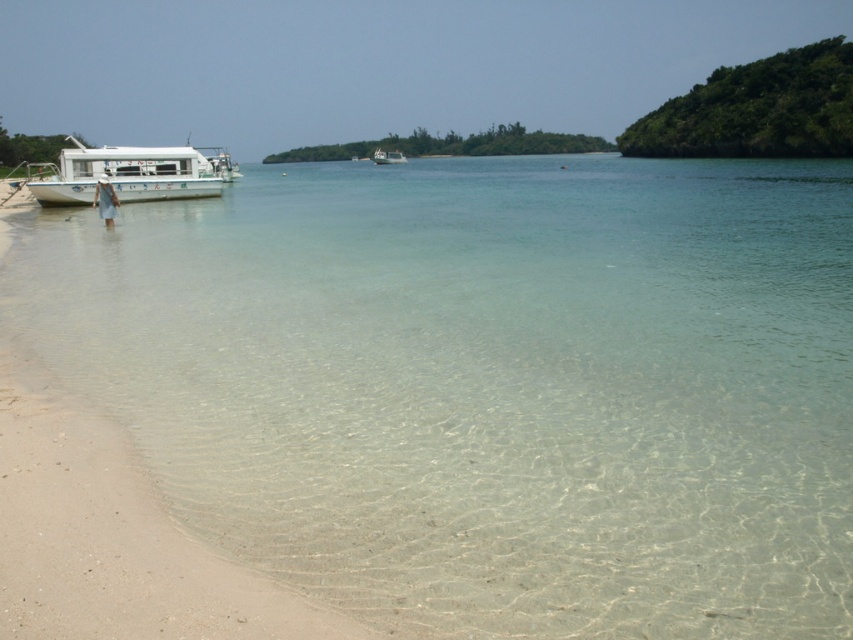
Between white matte boat at left and white glossy boat at center, which one appears on the right side from the viewer's perspective?

Positioned to the right is white glossy boat at center.

Is white matte boat at left taller than white glossy boat at center?

Correct, white matte boat at left is much taller as white glossy boat at center.

This screenshot has width=853, height=640. Identify the location of white matte boat at left. [129, 173].